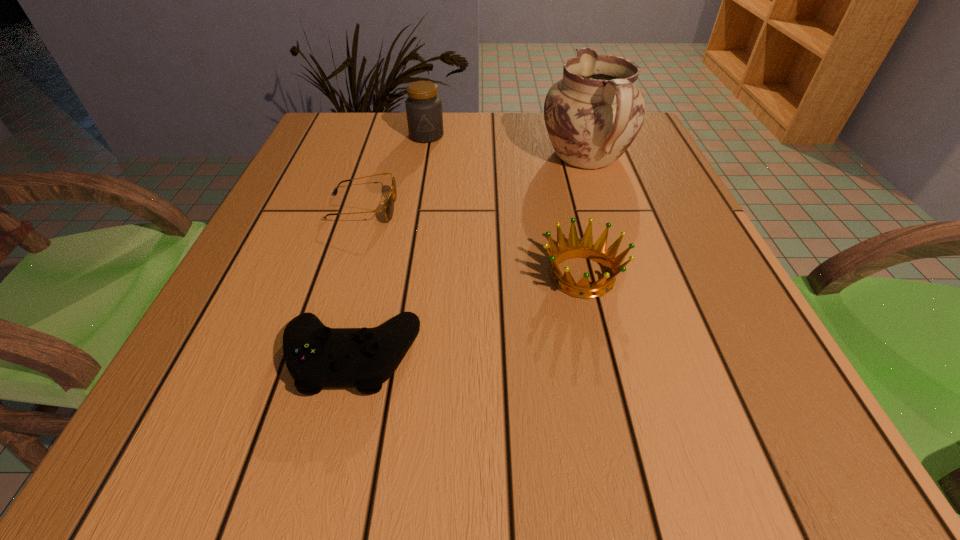
Locate an element on the screen. Image resolution: width=960 pixels, height=540 pixels. vacant area that lies between the second tallest object and the crown is located at coordinates (504, 206).

In order to click on vacant space in between the control and the pitcher in this screenshot , I will do `click(468, 258)`.

Locate an element on the screen. The height and width of the screenshot is (540, 960). free space between the shortest object and the nearest object is located at coordinates (357, 282).

This screenshot has width=960, height=540. I want to click on unoccupied position between the shortest object and the third tallest object, so click(472, 242).

Locate an element on the screen. This screenshot has width=960, height=540. free space that is in between the control and the tallest object is located at coordinates (468, 258).

Select which object is the closest to the pitcher. Please provide its 2D coordinates. Your answer should be formatted as a tuple, i.e. [(x, y)], where the tuple contains the x and y coordinates of a point satisfying the conditions above.

[(585, 249)]

You are a GUI agent. You are given a task and a screenshot of the screen. Output one action in this format:
    pyautogui.click(x=<x>, y=<y>)
    Task: Click on the fourth closest object to the fourth shortest object
    The height and width of the screenshot is (540, 960).
    Given the screenshot: What is the action you would take?
    pyautogui.click(x=317, y=357)

Find the location of a particular element. The image size is (960, 540). free space that satisfies the following two spatial constraints: 1. on the surface of the fourth shortest object near the warning symbol; 2. on the lenses of the sunglasses is located at coordinates (414, 208).

Locate an element on the screen. The image size is (960, 540). free spot that satisfies the following two spatial constraints: 1. on the surface of the second tallest object near the warning symbol; 2. on the lenses of the shortest object is located at coordinates (414, 208).

Locate an element on the screen. This screenshot has width=960, height=540. free space that satisfies the following two spatial constraints: 1. on the back side of the fourth farthest object; 2. on the right side of the nearest object is located at coordinates (372, 276).